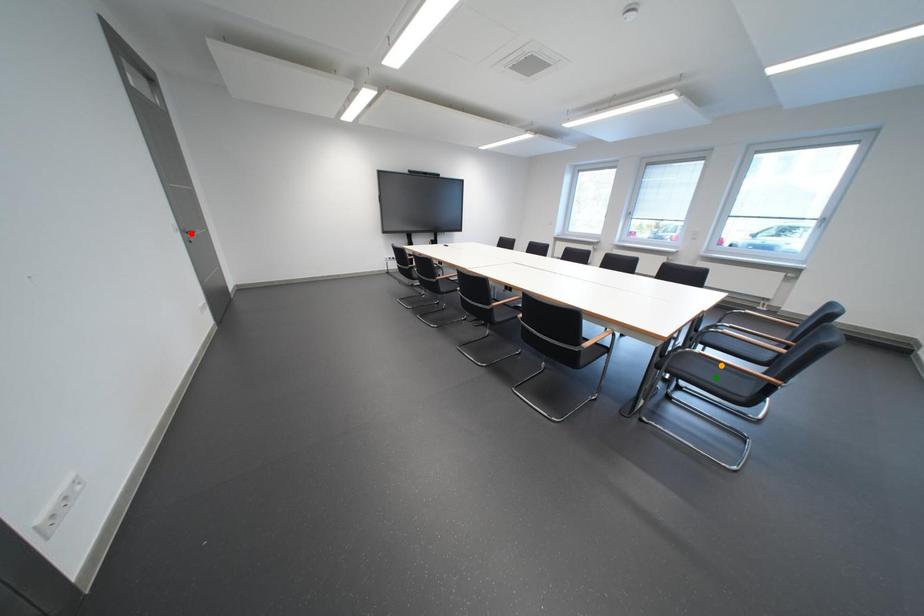
Consider the image. Order these from farthest to nearest:
A) orange point
B) green point
C) red point

orange point < red point < green point